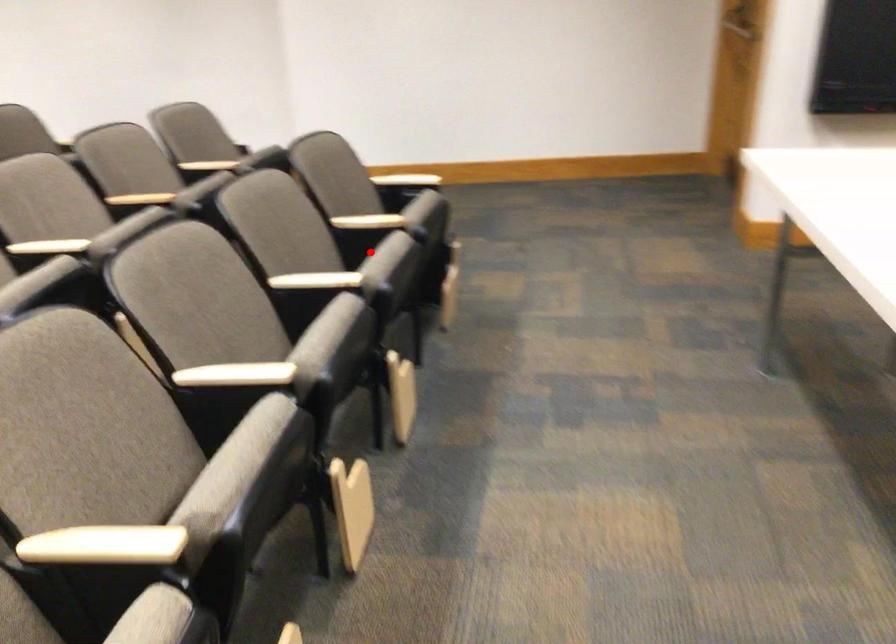
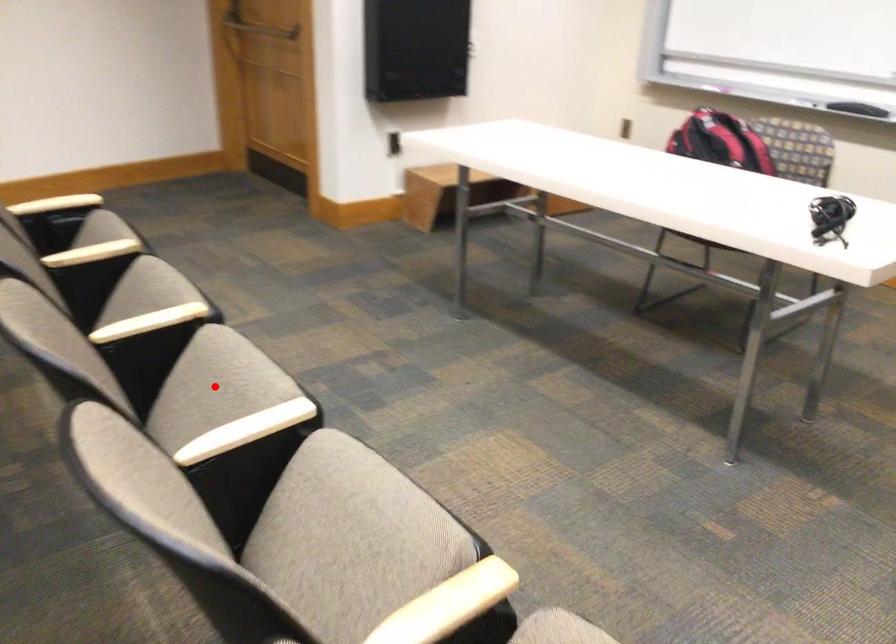
I am providing you with two images of the same scene from different viewpoints. A red point is marked on the first image and another point is marked on the second image. Does the point marked in image1 correspond to the same location as the one in image2?

No